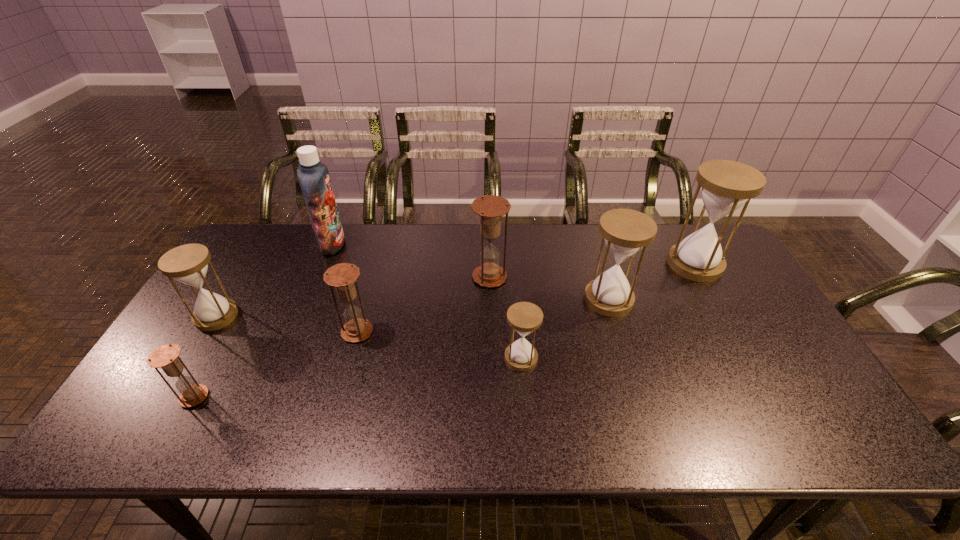
Locate an element on the screen. Image resolution: width=960 pixels, height=540 pixels. vacant region that satisfies the following two spatial constraints: 1. on the front label of the blue shampoo; 2. on the right side of the second object from right to left is located at coordinates (310, 299).

This screenshot has width=960, height=540. I want to click on vacant space that satisfies the following two spatial constraints: 1. on the front label of the fourth object from left to right; 2. on the right side of the blue shampoo, so click(298, 332).

Locate an element on the screen. Image resolution: width=960 pixels, height=540 pixels. free location that satisfies the following two spatial constraints: 1. on the back side of the leftmost white hourglass; 2. on the left side of the farthest brown hourglass is located at coordinates (240, 278).

You are a GUI agent. You are given a task and a screenshot of the screen. Output one action in this format:
    pyautogui.click(x=<x>, y=<y>)
    Task: Click on the vacant space that satisfies the following two spatial constraints: 1. on the back side of the farthest white hourglass; 2. on the left side of the second smallest brown hourglass
    Image resolution: width=960 pixels, height=540 pixels.
    Given the screenshot: What is the action you would take?
    pyautogui.click(x=375, y=264)

What are the coordinates of `free space that satisfies the following two spatial constraints: 1. on the back side of the fourth object from left to right; 2. on the front label of the sixth object from right to left` in the screenshot? It's located at (381, 244).